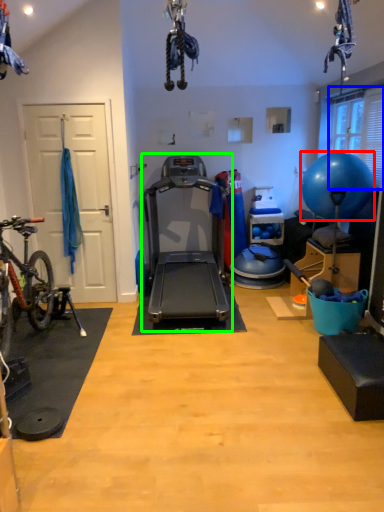
Question: Estimate the real-world distances between objects in this image. Which object is farther from ball (highlighted by a red box), window screen (highlighted by a blue box) or treadmill (highlighted by a green box)?

Choices:
 (A) window screen
 (B) treadmill

Answer: (B)